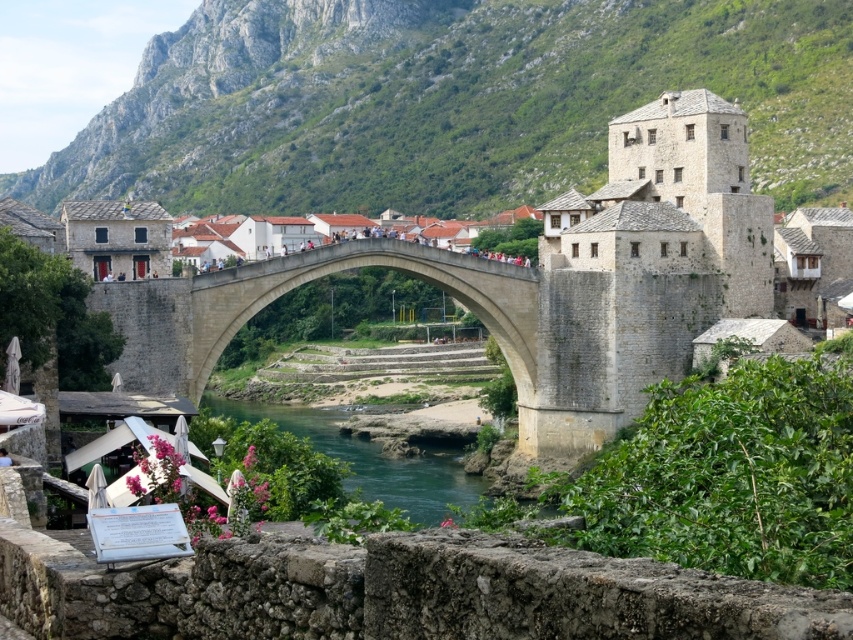
Question: Does green stone mountain at upper center appear on the left side of stone arch bridge at center?

Choices:
 (A) yes
 (B) no

Answer: (A)

Question: Among these points, which one is nearest to the camera?

Choices:
 (A) (454, 502)
 (B) (791, 193)

Answer: (A)

Question: Which point is farther to the camera?

Choices:
 (A) stone arch bridge at center
 (B) green stone river at center
 (C) green stone mountain at upper center

Answer: (C)

Question: Among these points, which one is nearest to the camera?

Choices:
 (A) (438, 483)
 (B) (515, 268)
 (C) (328, 60)

Answer: (B)

Question: Is green stone mountain at upper center closer to the viewer compared to stone arch bridge at center?

Choices:
 (A) yes
 (B) no

Answer: (B)

Question: Does green stone mountain at upper center have a smaller size compared to stone arch bridge at center?

Choices:
 (A) yes
 (B) no

Answer: (B)